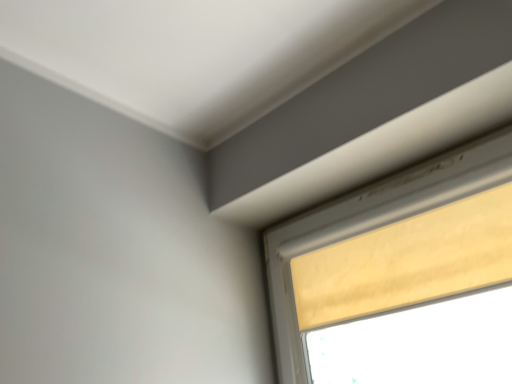
Locate an element on the screen. Image resolution: width=512 pixels, height=384 pixels. yellow fabric at upper right is located at coordinates (401, 277).

Measure the distance between yellow fabric at upper right and camera.

They are 2.85 meters apart.

Measure the distance between point (471, 181) and camera.

3.62 feet.

This screenshot has width=512, height=384. What do you see at coordinates (401, 277) in the screenshot?
I see `yellow fabric at upper right` at bounding box center [401, 277].

Image resolution: width=512 pixels, height=384 pixels. I want to click on yellow fabric at upper right, so click(401, 277).